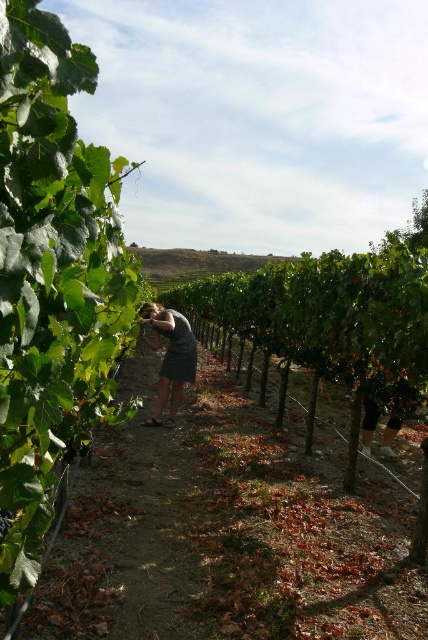
Is dark gray dress at center taller than green leafy grape at center-left?

Yes, dark gray dress at center is taller than green leafy grape at center-left.

Between point (175, 339) and point (2, 516), which one is positioned behind?

The point (175, 339) is more distant.

Locate an element on the screen. dark gray dress at center is located at coordinates (171, 356).